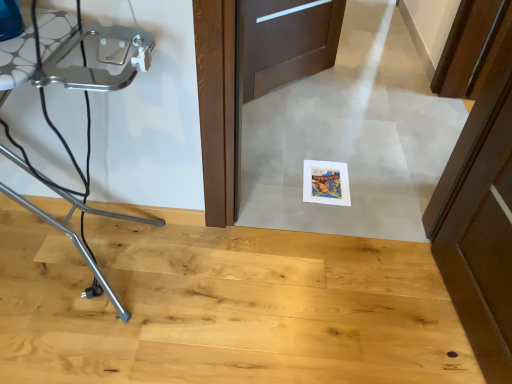
Question: Should I look upward or downward to see metallic silver tripod at left?

Choices:
 (A) down
 (B) up

Answer: (B)